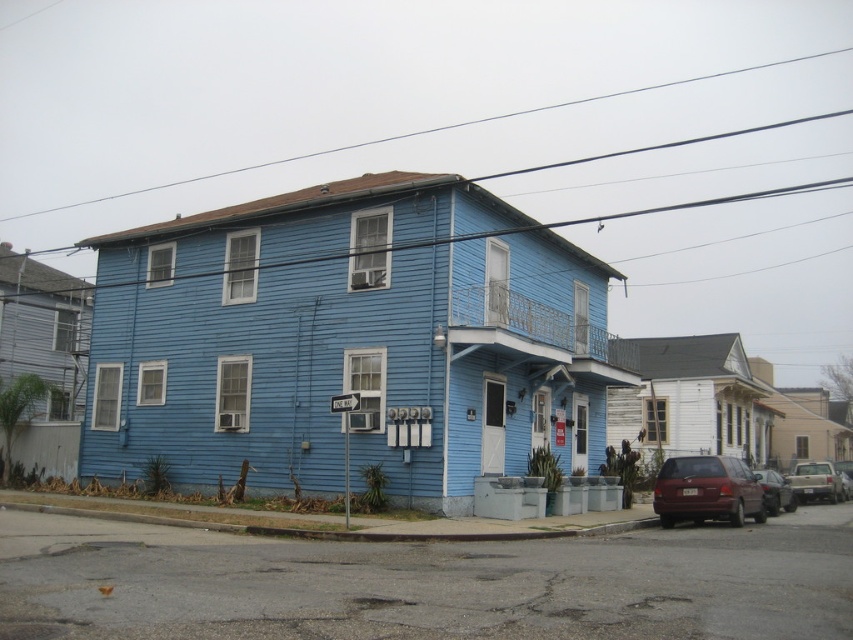
Based on the photo, which of these two, white wood trim at center or silver metallic suv at lower right, stands shorter?

With less height is silver metallic suv at lower right.

Is point (154, 256) positioned behind point (821, 468)?

No, (154, 256) is in front of (821, 468).

This screenshot has width=853, height=640. What are the coordinates of `white wood trim at center` in the screenshot? It's located at (350, 340).

Is point (724, 456) in front of point (819, 499)?

That is True.

Is matte maroon van at lower right above silver metallic suv at lower right?

Indeed, matte maroon van at lower right is positioned over silver metallic suv at lower right.

The height and width of the screenshot is (640, 853). What do you see at coordinates (706, 490) in the screenshot?
I see `matte maroon van at lower right` at bounding box center [706, 490].

Identify the location of matte maroon van at lower right. (706, 490).

Can you confirm if matte maroon van at lower right is positioned to the left of metallic silver car at lower right?

Yes, matte maroon van at lower right is to the left of metallic silver car at lower right.

This screenshot has width=853, height=640. What do you see at coordinates (706, 490) in the screenshot?
I see `matte maroon van at lower right` at bounding box center [706, 490].

Which is behind, point (724, 513) or point (779, 513)?

The point (779, 513) is more distant.

Image resolution: width=853 pixels, height=640 pixels. I want to click on matte maroon van at lower right, so click(706, 490).